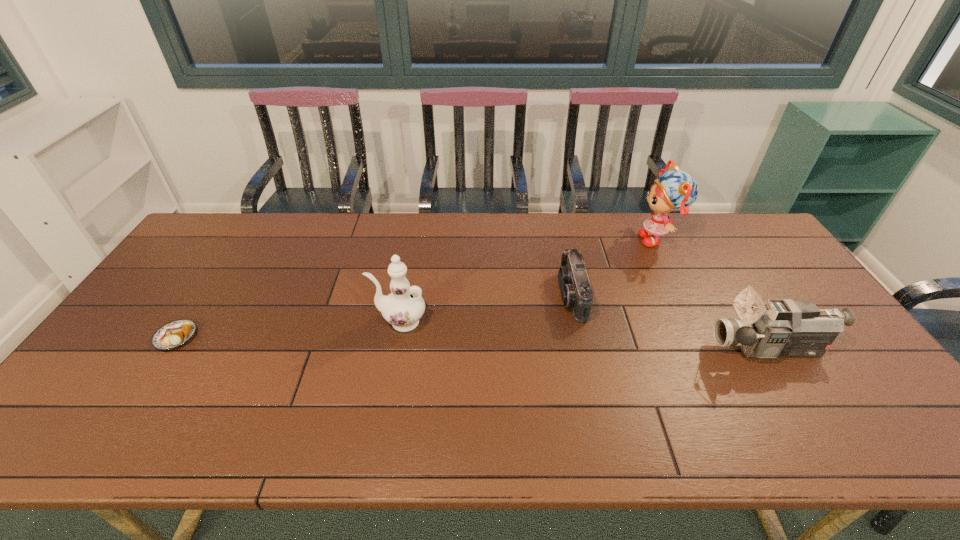
This screenshot has width=960, height=540. What are the coordinates of `vacant point located between the fourth tallest object and the second object from left to right` in the screenshot? It's located at (486, 309).

Where is `free spot between the nearer camcorder and the farther camcorder`? The width and height of the screenshot is (960, 540). free spot between the nearer camcorder and the farther camcorder is located at coordinates (671, 322).

You are a GUI agent. You are given a task and a screenshot of the screen. Output one action in this format:
    pyautogui.click(x=<x>, y=<y>)
    Task: Click on the empty space that is in between the left camcorder and the taller camcorder
    Image resolution: width=960 pixels, height=540 pixels.
    Given the screenshot: What is the action you would take?
    pyautogui.click(x=671, y=322)

This screenshot has height=540, width=960. I want to click on vacant space that is in between the chinaware and the leftmost object, so click(288, 329).

Where is `object identified as the third closest to the doll`? The image size is (960, 540). object identified as the third closest to the doll is located at coordinates (402, 308).

Find the location of a particular element. This screenshot has width=960, height=540. the third closest object to the doll is located at coordinates (402, 308).

Where is `free space that satisfies the following two spatial constraints: 1. on the front-facing side of the second shortest object; 2. on the front side of the leftmost object`? free space that satisfies the following two spatial constraints: 1. on the front-facing side of the second shortest object; 2. on the front side of the leftmost object is located at coordinates (582, 337).